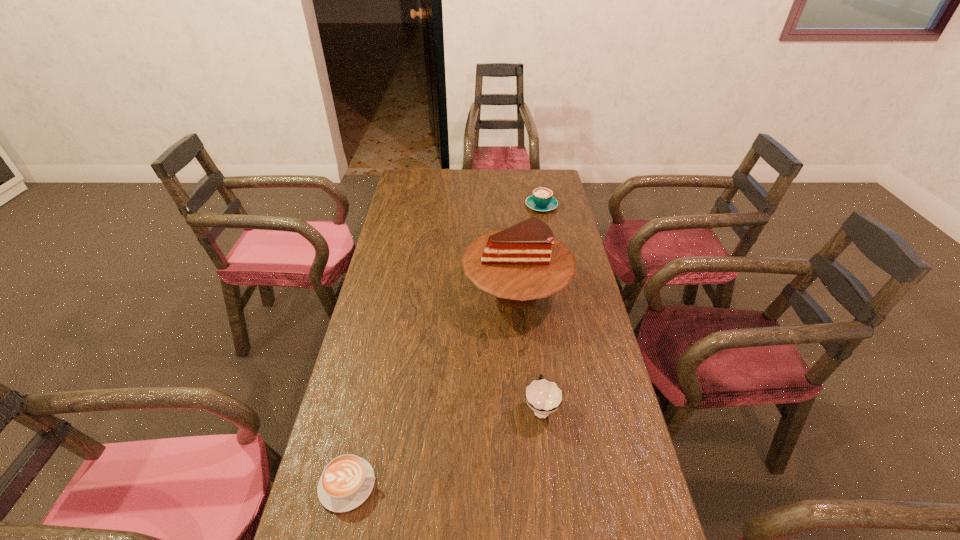
The image size is (960, 540). I want to click on unoccupied area between the shortest object and the third nearest object, so click(432, 388).

Locate an element on the screen. The image size is (960, 540). free spot between the cake and the third farthest object is located at coordinates (529, 350).

Select which object is the second closest to the right cappuccino. Please provide its 2D coordinates. Your answer should be formatted as a tuple, i.e. [(x, y)], where the tuple contains the x and y coordinates of a point satisfying the conditions above.

[(544, 397)]

You are a GUI agent. You are given a task and a screenshot of the screen. Output one action in this format:
    pyautogui.click(x=<x>, y=<y>)
    Task: Click on the object that is the closest to the farther cappuccino
    This screenshot has width=960, height=540.
    Given the screenshot: What is the action you would take?
    pyautogui.click(x=525, y=262)

Locate an element on the screen. vacant region that satisfies the following two spatial constraints: 1. on the front side of the tallest object; 2. on the side of the nearest object with the handle is located at coordinates (534, 484).